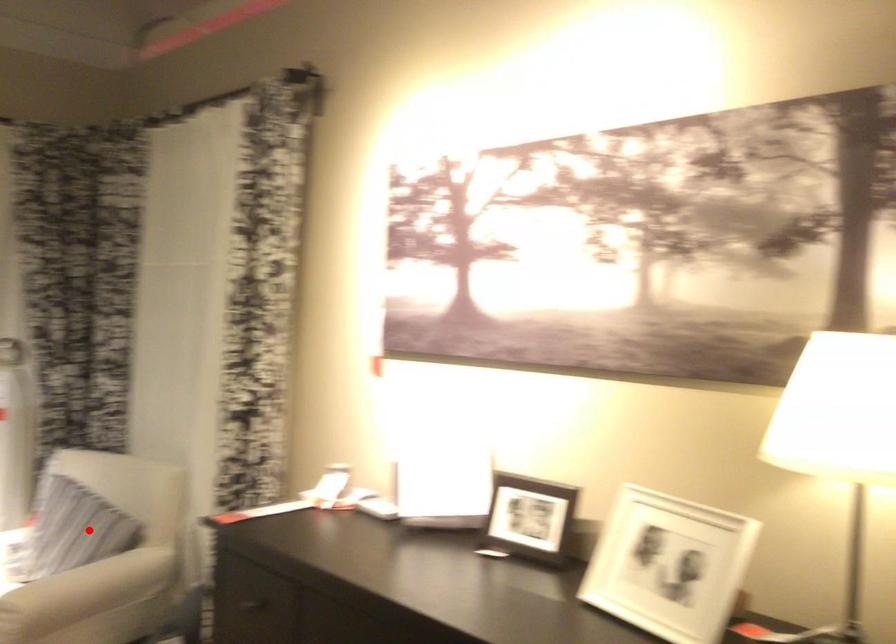
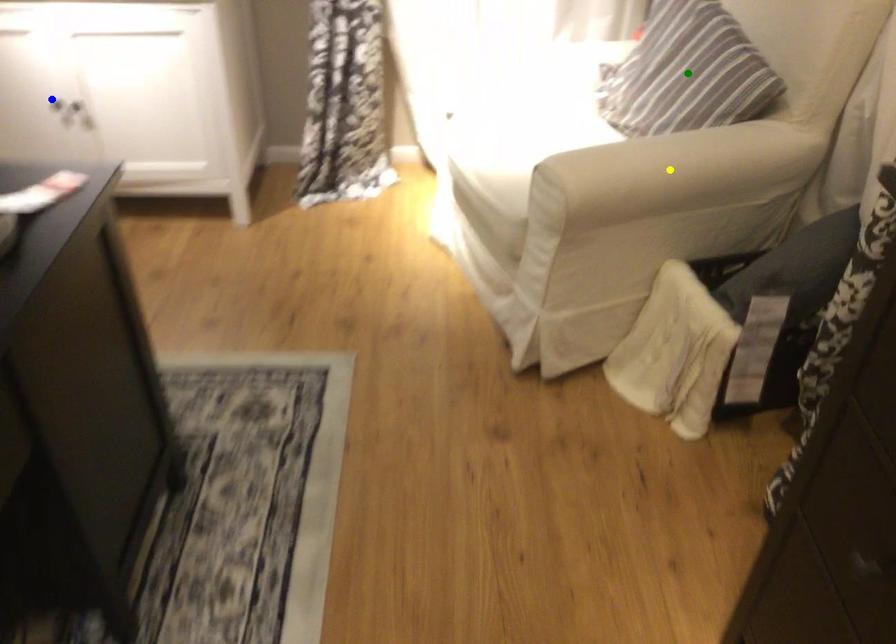
Question: I am providing you with two images of the same scene from different viewpoints. A red point is marked on the first image. You are given multiple points on the second image. Which spot in image 2 lines up with the point in image 1?

Choices:
 (A) blue point
 (B) yellow point
 (C) green point

Answer: (C)